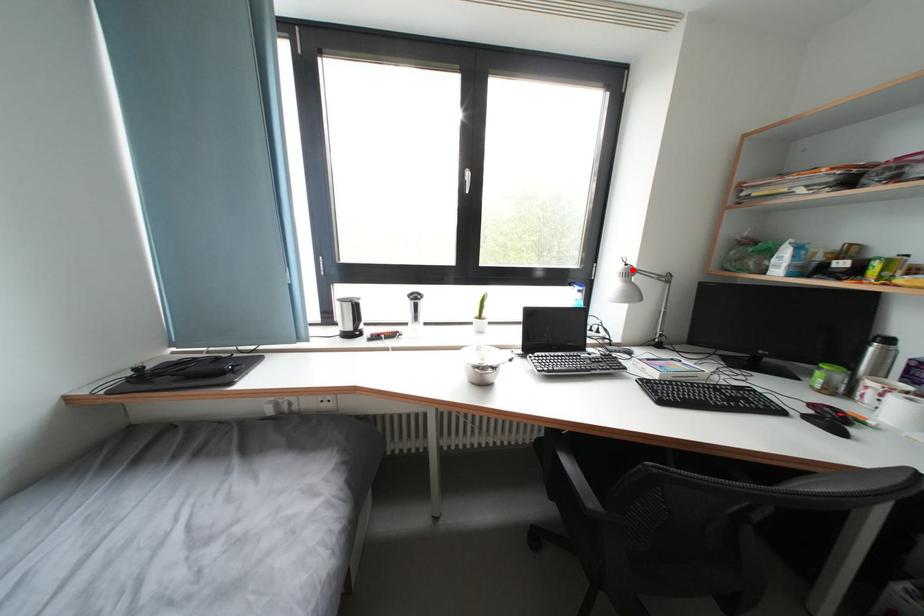
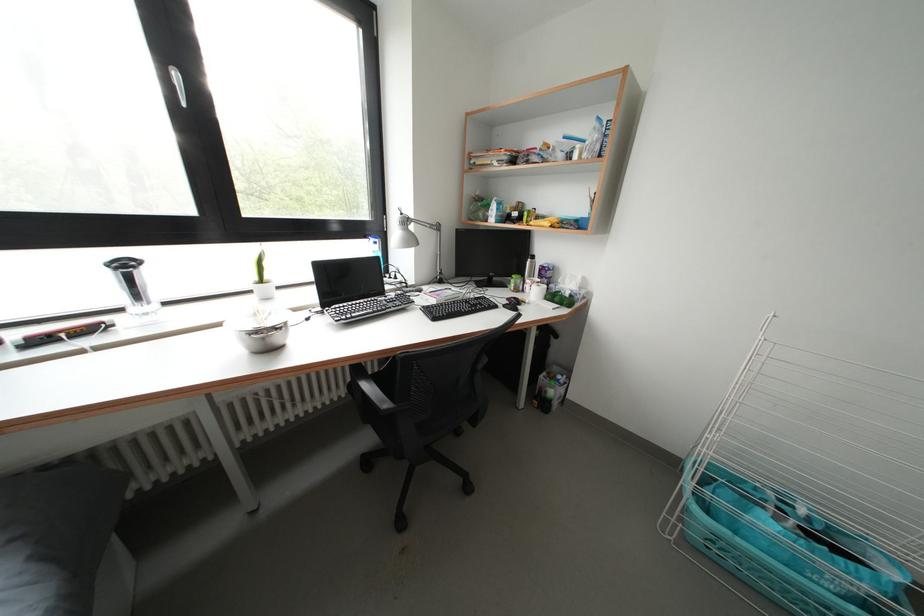
Where in the second image is the point corresponding to the highlighted location from the first image?

(408, 219)